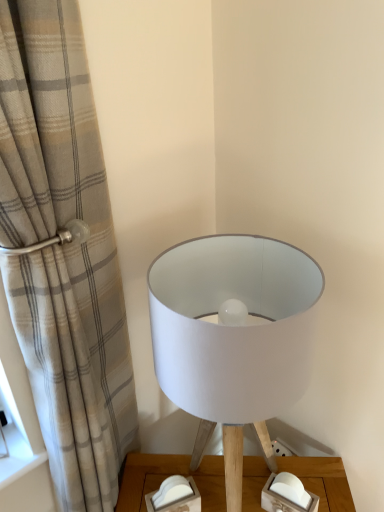
Question: Considering the positions of beige plaid curtain at left and white paper lampshade at center in the image, is beige plaid curtain at left bigger or smaller than white paper lampshade at center?

Choices:
 (A) big
 (B) small

Answer: (A)

Question: Based on their positions, is beige plaid curtain at left located to the left or right of white paper lampshade at center?

Choices:
 (A) right
 (B) left

Answer: (B)

Question: From a real-world perspective, is beige plaid curtain at left positioned above or below white paper lampshade at center?

Choices:
 (A) above
 (B) below

Answer: (A)

Question: Based on their sizes in the image, would you say white paper lampshade at center is bigger or smaller than beige plaid curtain at left?

Choices:
 (A) small
 (B) big

Answer: (A)

Question: Based on their positions, is white paper lampshade at center located to the left or right of beige plaid curtain at left?

Choices:
 (A) right
 (B) left

Answer: (A)

Question: Do you think white paper lampshade at center is within beige plaid curtain at left, or outside of it?

Choices:
 (A) inside
 (B) outside

Answer: (B)

Question: Is point (205, 415) closer or farther from the camera than point (38, 371)?

Choices:
 (A) closer
 (B) farther

Answer: (A)